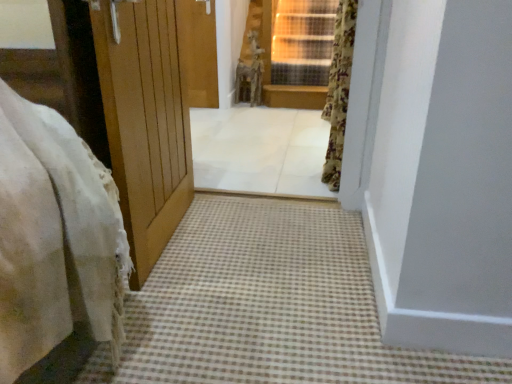
Question: From the image's perspective, is white tile floor at center below floral fabric curtain at upper right?

Choices:
 (A) no
 (B) yes

Answer: (B)

Question: Does white tile floor at center have a lesser width compared to floral fabric curtain at upper right?

Choices:
 (A) yes
 (B) no

Answer: (B)

Question: Is white tile floor at center looking in the opposite direction of floral fabric curtain at upper right?

Choices:
 (A) no
 (B) yes

Answer: (A)

Question: Considering the relative sizes of white tile floor at center and floral fabric curtain at upper right in the image provided, is white tile floor at center smaller than floral fabric curtain at upper right?

Choices:
 (A) no
 (B) yes

Answer: (A)

Question: Is floral fabric curtain at upper right a part of white tile floor at center?

Choices:
 (A) no
 (B) yes

Answer: (A)

Question: Is floral fabric curtain at upper right taller or shorter than white tile floor at center?

Choices:
 (A) tall
 (B) short

Answer: (A)

Question: Is point (340, 61) closer or farther from the camera than point (257, 160)?

Choices:
 (A) farther
 (B) closer

Answer: (B)

Question: Is floral fabric curtain at upper right situated inside white tile floor at center or outside?

Choices:
 (A) outside
 (B) inside

Answer: (A)

Question: From the image's perspective, relative to white tile floor at center, is floral fabric curtain at upper right above or below?

Choices:
 (A) above
 (B) below

Answer: (A)

Question: Based on their positions, is brown checkered carpet at lower center located to the left or right of floral fabric curtain at upper right?

Choices:
 (A) right
 (B) left

Answer: (B)

Question: From the image's perspective, is brown checkered carpet at lower center above or below floral fabric curtain at upper right?

Choices:
 (A) below
 (B) above

Answer: (A)

Question: Is point (142, 357) positioned closer to the camera than point (333, 51)?

Choices:
 (A) farther
 (B) closer

Answer: (B)

Question: Is brown checkered carpet at lower center taller or shorter than floral fabric curtain at upper right?

Choices:
 (A) tall
 (B) short

Answer: (B)

Question: From a real-world perspective, is white tile floor at center above or below brown checkered carpet at lower center?

Choices:
 (A) below
 (B) above

Answer: (B)

Question: Is white tile floor at center in front of or behind brown checkered carpet at lower center in the image?

Choices:
 (A) behind
 (B) front

Answer: (A)